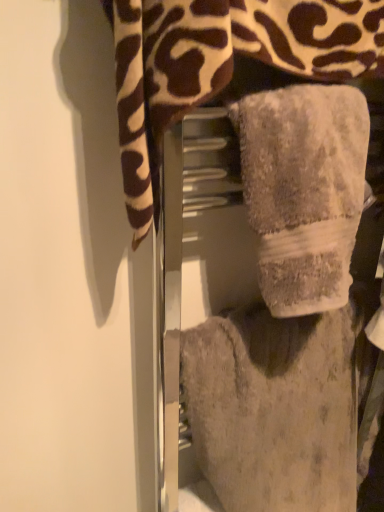
Question: In which direction should I rotate to look at gray plush towel at center, positioned as the 1th towel in top-to-bottom order?

Choices:
 (A) right
 (B) left

Answer: (A)

Question: Considering the relative sizes of fuzzy gray towel at center, the 3th towel viewed from the top, and gray fluffy towel at center, which is counted as the 2th towel, starting from the bottom, in the image provided, is fuzzy gray towel at center, the 3th towel viewed from the top, thinner than gray fluffy towel at center, which is counted as the 2th towel, starting from the bottom,?

Choices:
 (A) no
 (B) yes

Answer: (A)

Question: Is fuzzy gray towel at center, the 3th towel viewed from the top, looking in the opposite direction of gray fluffy towel at center, which is counted as the 2th towel, starting from the bottom?

Choices:
 (A) yes
 (B) no

Answer: (B)

Question: From the image's perspective, is fuzzy gray towel at center, which ranks as the 1th towel in bottom-to-top order, located beneath gray fluffy towel at center, marked as the 2th towel in a top-to-bottom arrangement?

Choices:
 (A) yes
 (B) no

Answer: (A)

Question: Considering the relative sizes of fuzzy gray towel at center, which ranks as the 1th towel in bottom-to-top order, and gray fluffy towel at center, marked as the 2th towel in a top-to-bottom arrangement, in the image provided, is fuzzy gray towel at center, which ranks as the 1th towel in bottom-to-top order, taller than gray fluffy towel at center, marked as the 2th towel in a top-to-bottom arrangement,?

Choices:
 (A) no
 (B) yes

Answer: (B)

Question: Considering the relative sizes of fuzzy gray towel at center, which ranks as the 1th towel in bottom-to-top order, and gray fluffy towel at center, which is counted as the 2th towel, starting from the bottom, in the image provided, is fuzzy gray towel at center, which ranks as the 1th towel in bottom-to-top order, shorter than gray fluffy towel at center, which is counted as the 2th towel, starting from the bottom,?

Choices:
 (A) no
 (B) yes

Answer: (A)

Question: Would you say gray fluffy towel at center, which is counted as the 2th towel, starting from the bottom, is part of fuzzy gray towel at center, which ranks as the 1th towel in bottom-to-top order,'s contents?

Choices:
 (A) yes
 (B) no

Answer: (B)

Question: From a real-world perspective, is fuzzy gray towel at center, the 3th towel viewed from the top, on top of gray plush towel at center, the 3th towel when ordered from bottom to top?

Choices:
 (A) no
 (B) yes

Answer: (A)

Question: Is fuzzy gray towel at center, which ranks as the 1th towel in bottom-to-top order, surrounding gray plush towel at center, positioned as the 1th towel in top-to-bottom order?

Choices:
 (A) no
 (B) yes

Answer: (A)

Question: Is fuzzy gray towel at center, which ranks as the 1th towel in bottom-to-top order, at the right side of gray plush towel at center, the 3th towel when ordered from bottom to top?

Choices:
 (A) no
 (B) yes

Answer: (B)

Question: Considering the relative sizes of fuzzy gray towel at center, which ranks as the 1th towel in bottom-to-top order, and gray plush towel at center, positioned as the 1th towel in top-to-bottom order, in the image provided, is fuzzy gray towel at center, which ranks as the 1th towel in bottom-to-top order, smaller than gray plush towel at center, positioned as the 1th towel in top-to-bottom order,?

Choices:
 (A) yes
 (B) no

Answer: (B)

Question: Are fuzzy gray towel at center, which ranks as the 1th towel in bottom-to-top order, and gray plush towel at center, positioned as the 1th towel in top-to-bottom order, making contact?

Choices:
 (A) yes
 (B) no

Answer: (B)

Question: Can we say fuzzy gray towel at center, the 3th towel viewed from the top, lies outside gray plush towel at center, the 3th towel when ordered from bottom to top?

Choices:
 (A) no
 (B) yes

Answer: (B)

Question: Considering the relative positions of gray fluffy towel at center, which is counted as the 2th towel, starting from the bottom, and gray plush towel at center, the 3th towel when ordered from bottom to top, in the image provided, is gray fluffy towel at center, which is counted as the 2th towel, starting from the bottom, in front of gray plush towel at center, the 3th towel when ordered from bottom to top,?

Choices:
 (A) no
 (B) yes

Answer: (A)